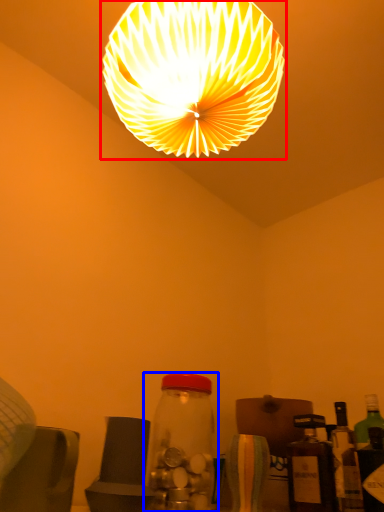
Question: Among these objects, which one is nearest to the camera, lamp (highlighted by a red box) or bottle (highlighted by a blue box)?

Choices:
 (A) lamp
 (B) bottle

Answer: (A)